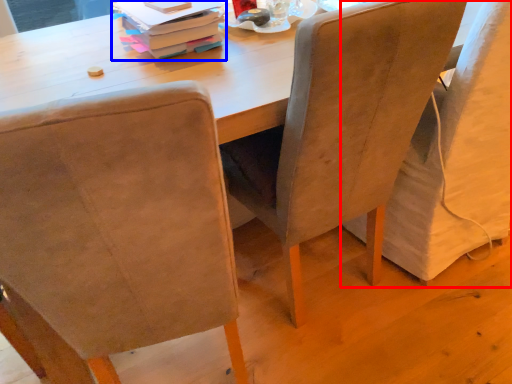
Question: Which object appears farthest to the camera in this image, chair (highlighted by a red box) or book (highlighted by a blue box)?

Choices:
 (A) chair
 (B) book

Answer: (B)